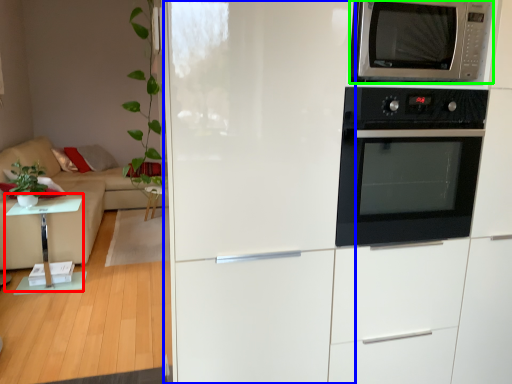
Question: Which is farther away from table (highlighted by a red box)? fridge (highlighted by a blue box) or microwave oven (highlighted by a green box)?

Choices:
 (A) fridge
 (B) microwave oven

Answer: (B)